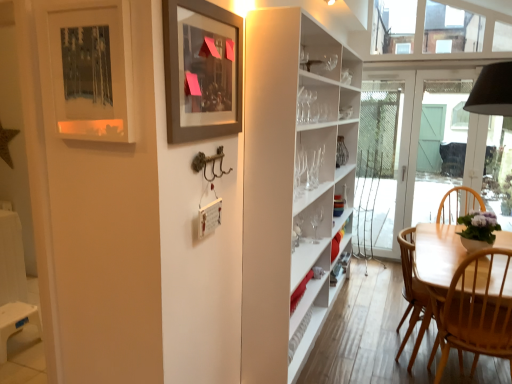
Question: Considering their positions, is matte gray picture frame at upper center, which is the first picture frame in right-to-left order, located in front of or behind light wood chair at lower right?

Choices:
 (A) behind
 (B) front

Answer: (B)

Question: From a real-world perspective, relative to light wood chair at lower right, is matte gray picture frame at upper center, which is the second picture frame from left to right, vertically above or below?

Choices:
 (A) above
 (B) below

Answer: (A)

Question: Estimate the real-world distances between objects in this image. Which object is closer to the matte black picture frame at upper left, which ranks as the 2th picture frame in right-to-left order?

Choices:
 (A) light wood chair at lower right
 (B) matte gray picture frame at upper center, which is the second picture frame from left to right
 (C) white glass door at center

Answer: (B)

Question: Estimate the real-world distances between objects in this image. Which object is closer to the matte black picture frame at upper left, which ranks as the 2th picture frame in right-to-left order?

Choices:
 (A) light wood chair at lower right
 (B) matte gray picture frame at upper center, which is the first picture frame in right-to-left order
 (C) white glass door at center

Answer: (B)